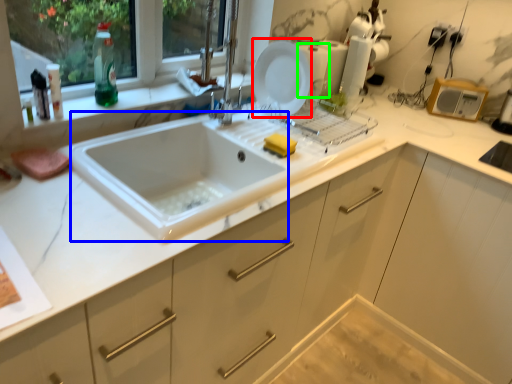
Question: Which object is positioned farthest from plate (highlighted by a red box)? Select from sink (highlighted by a blue box) and appliance (highlighted by a green box).

Choices:
 (A) sink
 (B) appliance

Answer: (A)